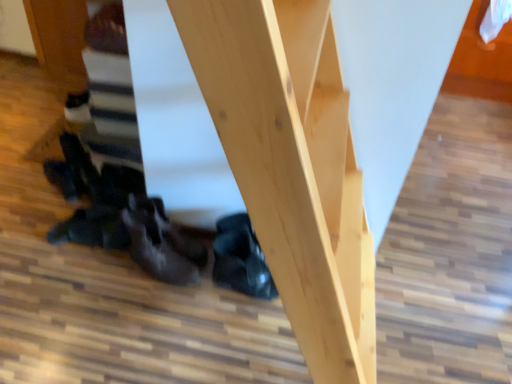
At what (x,y) coordinates should I click in order to perform the action: click on vacant space that is to the left of dark brown leather shoe at center, the 2th leather shoe in the right-to-left sequence. Please return your answer as a coordinate pair (x, y). Looking at the image, I should click on (93, 277).